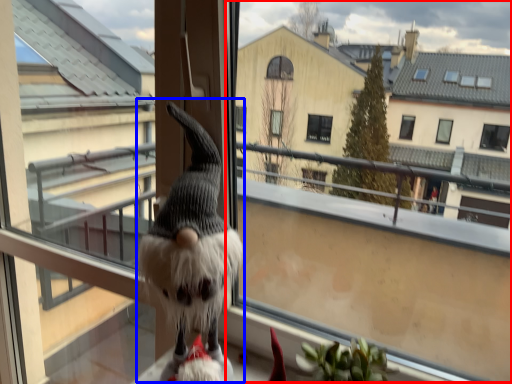
Question: Which point is closer to the camera, window screen (highlighted by a red box) or animal (highlighted by a blue box)?

Choices:
 (A) window screen
 (B) animal

Answer: (A)